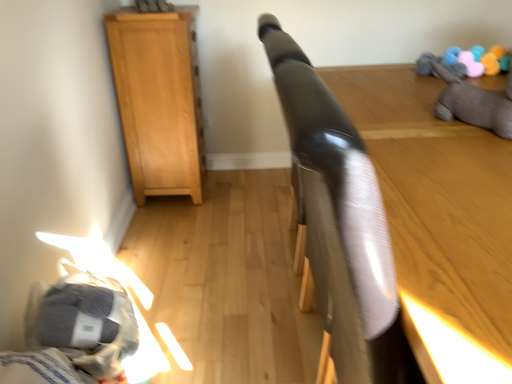
The height and width of the screenshot is (384, 512). I want to click on free space in front of gray plush toy at upper right, so click(469, 150).